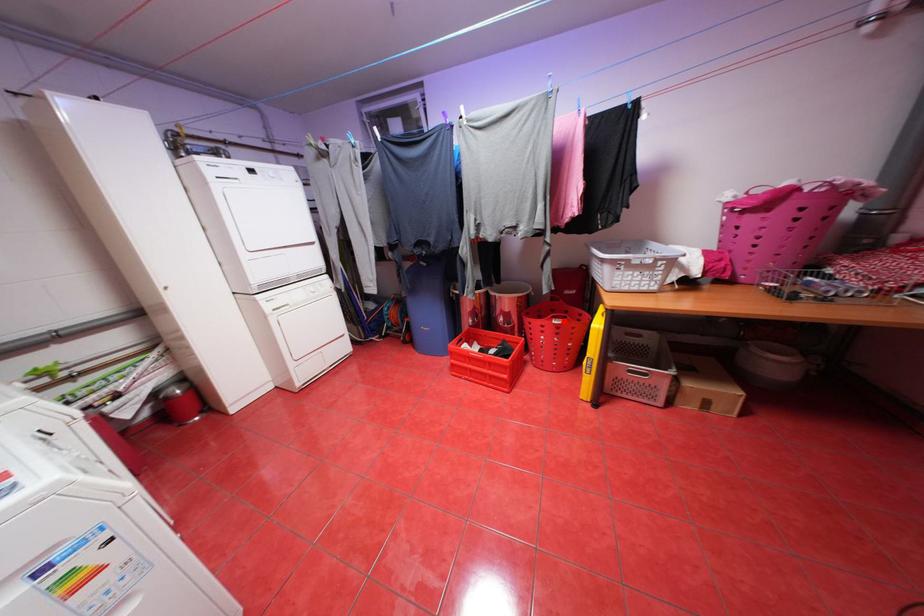
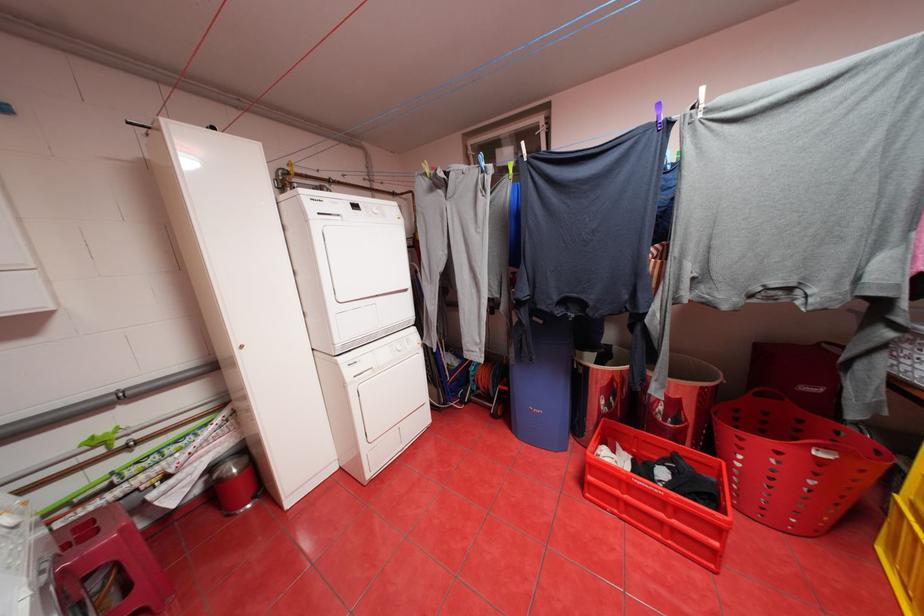
The point at the highlighted location is marked in the first image. Where is the corresponding point in the second image?

(828, 453)